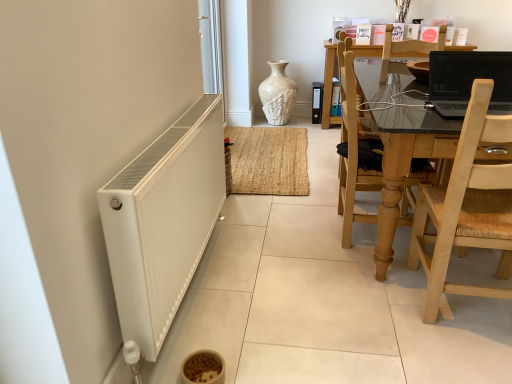
Identify the location of empty space that is in between light wood woven seat at right, which appears as the first chair when viewed from the front, and white matte radiator at lower left. The height and width of the screenshot is (384, 512). (314, 299).